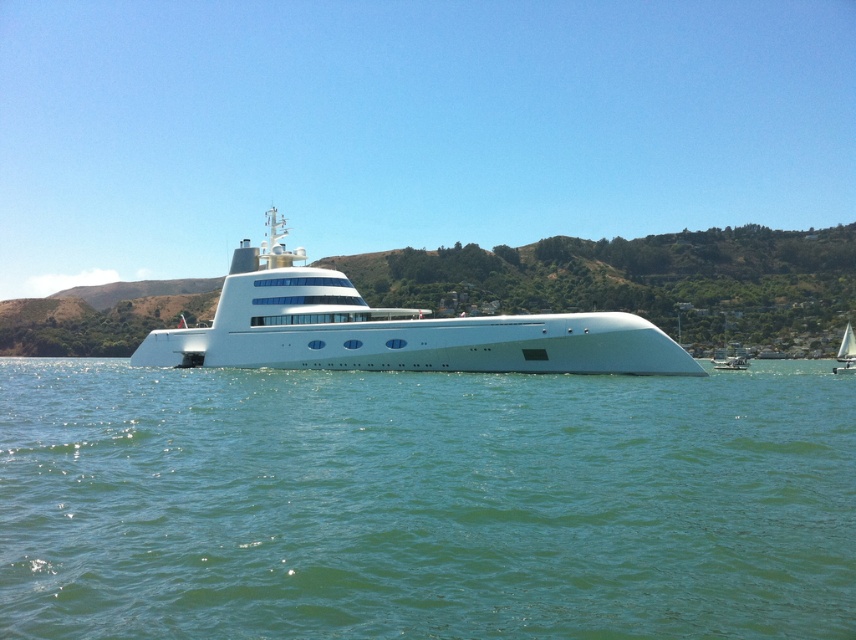
You are a photographer standing on the deck of the yacht and want to capture a closeup shot of the clear blue water at center. Your camera has a minimum focusing distance of 14 meters. Will you be able to take the photo without moving closer?

The clear blue water at center is 14.23 meters from the camera. Since the minimum focusing distance is 14 meters, the photographer can take the photo without moving closer as the distance is slightly beyond the minimum requirement.

You are standing on the deck of the yacht and see the point at coordinates (424, 502). What is located at that point?

The point at coordinates (424, 502) corresponds to clear blue water at center.